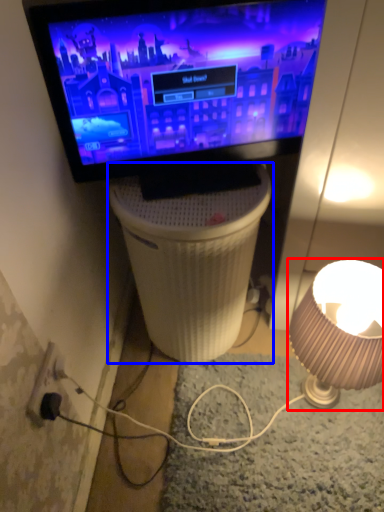
Question: Which object appears farthest to the camera in this image, lamp (highlighted by a red box) or table (highlighted by a blue box)?

Choices:
 (A) lamp
 (B) table

Answer: (B)